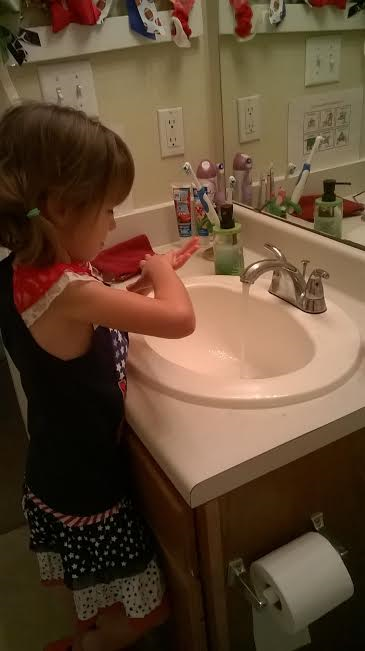
Find the location of a particular element. faucet is located at coordinates click(263, 268).